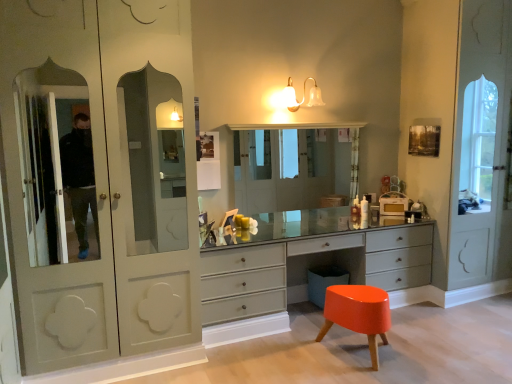
What do you see at coordinates (303, 96) in the screenshot? The height and width of the screenshot is (384, 512). I see `translucent glass sconce at upper center` at bounding box center [303, 96].

I want to click on translucent glass sconce at upper center, so click(303, 96).

Image resolution: width=512 pixels, height=384 pixels. Find the location of `orange glossy stool at lower right`. orange glossy stool at lower right is located at coordinates (358, 313).

This screenshot has width=512, height=384. Find the location of `clear glass medicine cabinet at center`. clear glass medicine cabinet at center is located at coordinates (293, 168).

Considering their positions, is matte white wardrobe at left located in front of or behind clear glass medicine cabinet at center?

matte white wardrobe at left is positioned closer to the viewer than clear glass medicine cabinet at center.

Does matte white wardrobe at left turn towards clear glass medicine cabinet at center?

No, matte white wardrobe at left does not turn towards clear glass medicine cabinet at center.

From their relative heights in the image, would you say matte white wardrobe at left is taller or shorter than clear glass medicine cabinet at center?

Clearly, matte white wardrobe at left is taller compared to clear glass medicine cabinet at center.

Does matte white wardrobe at left have a smaller size compared to satin gray dresser at center?

No, matte white wardrobe at left is not smaller than satin gray dresser at center.

Are matte white wardrobe at left and satin gray dresser at center making contact?

matte white wardrobe at left is not next to satin gray dresser at center, and they're not touching.

Between matte white wardrobe at left and satin gray dresser at center, which one appears on the left side from the viewer's perspective?

matte white wardrobe at left.

Does matte white wardrobe at left turn towards satin gray dresser at center?

No, matte white wardrobe at left does not turn towards satin gray dresser at center.

Is satin gray dresser at center bigger than translucent glass sconce at upper center?

Yes, satin gray dresser at center is bigger than translucent glass sconce at upper center.

From the image's perspective, between satin gray dresser at center and translucent glass sconce at upper center, which one is located above?

From the image's view, translucent glass sconce at upper center is above.

Which object is closer to the camera, satin gray dresser at center or translucent glass sconce at upper center?

Positioned in front is satin gray dresser at center.

Can you confirm if satin gray dresser at center is positioned to the right of translucent glass sconce at upper center?

Indeed, satin gray dresser at center is positioned on the right side of translucent glass sconce at upper center.

How many degrees apart are the facing directions of clear glass medicine cabinet at center and translucent glass sconce at upper center?

clear glass medicine cabinet at center and translucent glass sconce at upper center are facing 0.832 degrees away from each other.

Who is smaller, clear glass medicine cabinet at center or translucent glass sconce at upper center?

With smaller size is translucent glass sconce at upper center.

Find the location of `medicine cabinet on the right of translucent glass sconce at upper center`. medicine cabinet on the right of translucent glass sconce at upper center is located at coordinates (293, 168).

Can we say clear glass medicine cabinet at center lies outside translucent glass sconce at upper center?

That's correct, clear glass medicine cabinet at center is outside of translucent glass sconce at upper center.

Is clear glass medicine cabinet at center in contact with orange glossy stool at lower right?

They are not placed beside each other.

Does clear glass medicine cabinet at center have a smaller size compared to orange glossy stool at lower right?

Yes, clear glass medicine cabinet at center is smaller than orange glossy stool at lower right.

This screenshot has width=512, height=384. Identify the location of stool below the clear glass medicine cabinet at center (from a real-world perspective). click(x=358, y=313).

Does clear glass medicine cabinet at center have a greater width compared to orange glossy stool at lower right?

No, clear glass medicine cabinet at center is not wider than orange glossy stool at lower right.

From the picture: Is satin gray dresser at center oriented towards matte white wardrobe at left?

No, satin gray dresser at center is not turned towards matte white wardrobe at left.

Does satin gray dresser at center have a smaller size compared to matte white wardrobe at left?

Yes.

From the image's perspective, which one is positioned higher, satin gray dresser at center or matte white wardrobe at left?

matte white wardrobe at left, from the image's perspective.

From a real-world perspective, is satin gray dresser at center located higher than matte white wardrobe at left?

Actually, satin gray dresser at center is physically below matte white wardrobe at left in the real world.

Is satin gray dresser at center aimed at clear glass medicine cabinet at center?

No.

Does point (337, 240) lie behind point (314, 161)?

No, it is not.

Based on their positions, is satin gray dresser at center located to the left or right of clear glass medicine cabinet at center?

In the image, satin gray dresser at center appears on the right side of clear glass medicine cabinet at center.

I want to click on cupboard above the clear glass medicine cabinet at center (from a real-world perspective), so click(100, 178).

Locate an element on the screen. the chest of drawers located underneath the matte white wardrobe at left (from a real-world perspective) is located at coordinates (310, 268).

Looking at this image, when comparing their distances from clear glass medicine cabinet at center, does orange glossy stool at lower right or matte white wardrobe at left seem further?

matte white wardrobe at left lies further to clear glass medicine cabinet at center than the other object.

When comparing their distances from translucent glass sconce at upper center, does satin gray dresser at center or orange glossy stool at lower right seem further?

orange glossy stool at lower right is positioned further to the anchor translucent glass sconce at upper center.

When comparing their distances from translucent glass sconce at upper center, does matte white wardrobe at left or clear glass medicine cabinet at center seem further?

clear glass medicine cabinet at center is positioned further to the anchor translucent glass sconce at upper center.

Looking at the image, which one is located closer to matte white wardrobe at left, clear glass medicine cabinet at center or translucent glass sconce at upper center?

translucent glass sconce at upper center is closer to matte white wardrobe at left.

Estimate the real-world distances between objects in this image. Which object is further from translucent glass sconce at upper center, satin gray dresser at center or matte white wardrobe at left?

matte white wardrobe at left.

In the scene shown: Considering their positions, is matte white wardrobe at left positioned further to orange glossy stool at lower right than clear glass medicine cabinet at center?

clear glass medicine cabinet at center is further to orange glossy stool at lower right.

Based on their spatial positions, is satin gray dresser at center or clear glass medicine cabinet at center further from translucent glass sconce at upper center?

clear glass medicine cabinet at center lies further to translucent glass sconce at upper center than the other object.

When comparing their distances from clear glass medicine cabinet at center, does orange glossy stool at lower right or satin gray dresser at center seem closer?

satin gray dresser at center lies closer to clear glass medicine cabinet at center than the other object.

Where is `chest of drawers between matte white wardrobe at left and orange glossy stool at lower right from left to right`? This screenshot has width=512, height=384. chest of drawers between matte white wardrobe at left and orange glossy stool at lower right from left to right is located at coordinates (310, 268).

Locate an element on the screen. medicine cabinet between matte white wardrobe at left and orange glossy stool at lower right in the horizontal direction is located at coordinates (293, 168).

Identify the location of medicine cabinet that lies between translucent glass sconce at upper center and orange glossy stool at lower right from top to bottom. pos(293,168).

The height and width of the screenshot is (384, 512). Find the location of `light fixture situated between matte white wardrobe at left and clear glass medicine cabinet at center from left to right`. light fixture situated between matte white wardrobe at left and clear glass medicine cabinet at center from left to right is located at coordinates (303, 96).